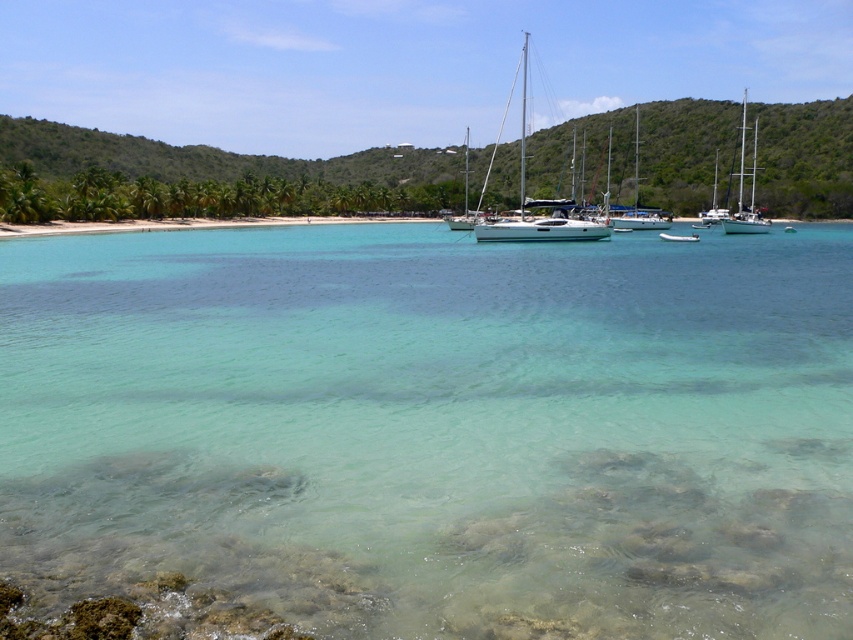
You are standing at the beach and want to reach the point marked as point (726, 360). If your walking speed is 3 feet per second, how many seconds will it take you to reach that point?

The distance between you and point (726, 360) is 50.76 feet. At a speed of 3 feet per second, it will take 50.76 divided by 3, which is approximately 16.92 seconds to reach the point.